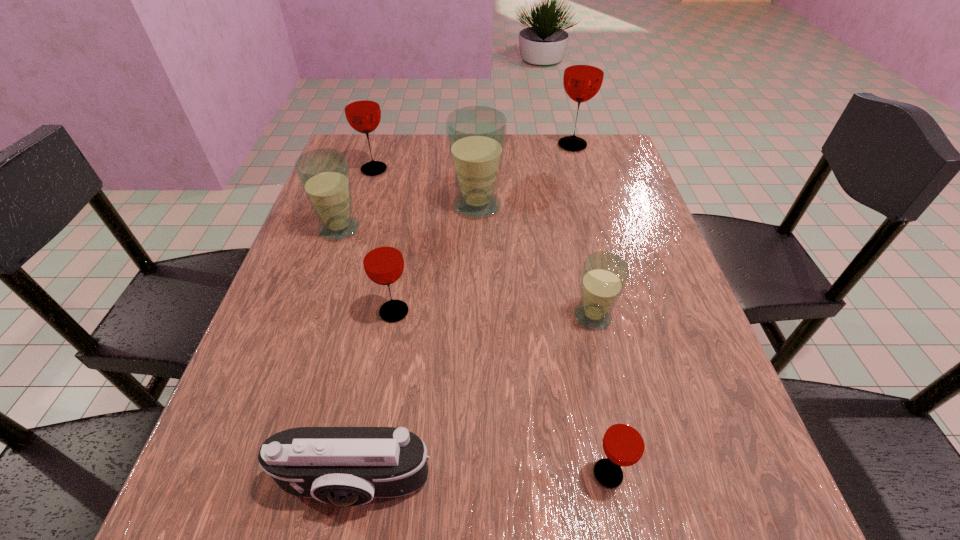
Identify the location of the biggest red glass. (583, 76).

Locate an element on the screen. The image size is (960, 540). the farthest object is located at coordinates (583, 76).

Locate an element on the screen. the sixth nearest glass is located at coordinates (362, 110).

Locate an element on the screen. The height and width of the screenshot is (540, 960). the third smallest red glass is located at coordinates point(362,110).

Locate an element on the screen. The image size is (960, 540). the second blue glass from right to left is located at coordinates (476, 135).

This screenshot has width=960, height=540. In order to click on the biggest blue glass in this screenshot , I will do `click(476, 135)`.

This screenshot has height=540, width=960. I want to click on the second nearest red glass, so click(x=383, y=262).

Find the location of a particular element. The height and width of the screenshot is (540, 960). the second smallest red glass is located at coordinates (383, 262).

Identify the location of the leftmost blue glass. (324, 175).

Locate an element on the screen. This screenshot has width=960, height=540. the third red glass from left to right is located at coordinates (624, 442).